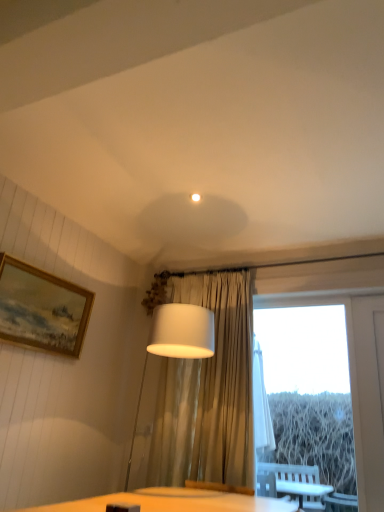
Question: Is white fabric lampshade at center to the right of gold-framed painting at upper left from the viewer's perspective?

Choices:
 (A) no
 (B) yes

Answer: (B)

Question: Is white fabric lampshade at center positioned behind gold-framed painting at upper left?

Choices:
 (A) yes
 (B) no

Answer: (B)

Question: From the image's perspective, is white fabric lampshade at center under gold-framed painting at upper left?

Choices:
 (A) yes
 (B) no

Answer: (A)

Question: Does white fabric lampshade at center lie in front of gold-framed painting at upper left?

Choices:
 (A) yes
 (B) no

Answer: (A)

Question: From a real-world perspective, is white fabric lampshade at center located beneath gold-framed painting at upper left?

Choices:
 (A) no
 (B) yes

Answer: (B)

Question: Is white fabric lampshade at center at the left side of gold-framed painting at upper left?

Choices:
 (A) no
 (B) yes

Answer: (A)

Question: Is gold-framed painting at upper left positioned before white fabric lampshade at center?

Choices:
 (A) no
 (B) yes

Answer: (A)

Question: Is gold-framed painting at upper left taller than white fabric lampshade at center?

Choices:
 (A) yes
 (B) no

Answer: (B)

Question: Are gold-framed painting at upper left and white fabric lampshade at center located far from each other?

Choices:
 (A) no
 (B) yes

Answer: (A)

Question: From a real-world perspective, is gold-framed painting at upper left on top of white fabric lampshade at center?

Choices:
 (A) no
 (B) yes

Answer: (B)

Question: Is gold-framed painting at upper left positioned with its back to white fabric lampshade at center?

Choices:
 (A) no
 (B) yes

Answer: (A)

Question: Can we say gold-framed painting at upper left lies outside white fabric lampshade at center?

Choices:
 (A) no
 (B) yes

Answer: (B)

Question: Does transparent glass window at center have a larger size compared to white fabric lampshade at center?

Choices:
 (A) no
 (B) yes

Answer: (A)